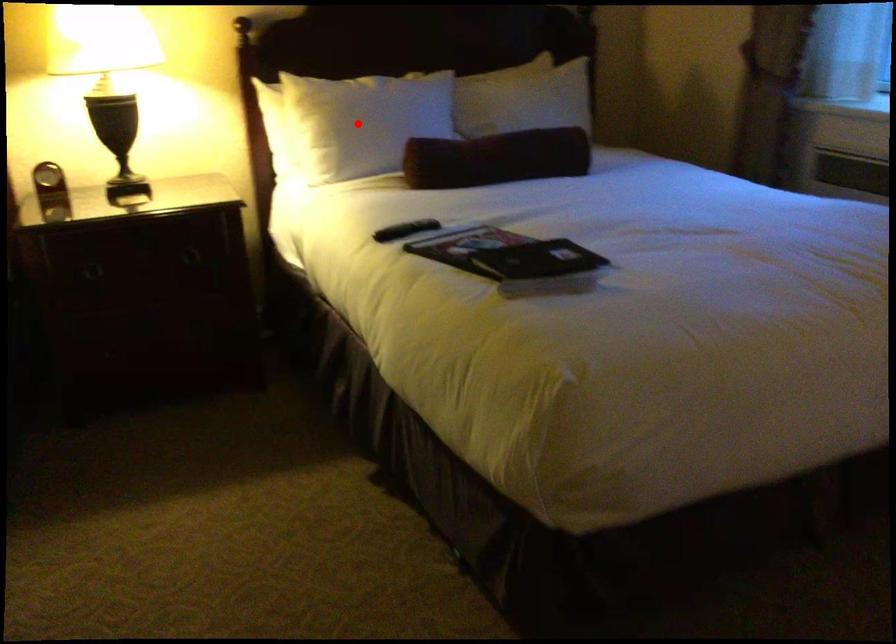
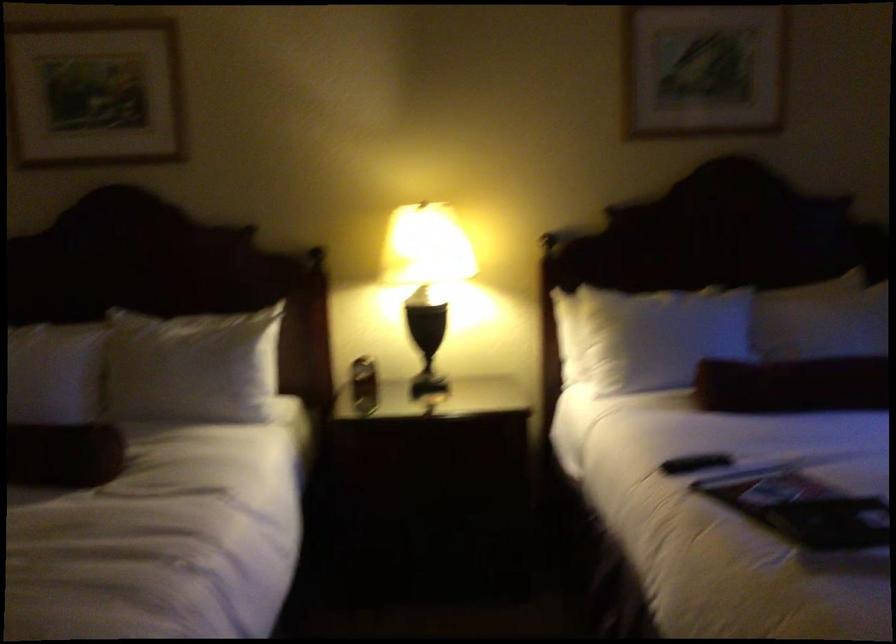
Find the pixel in the second image that matches the highlighted location in the first image.

(652, 337)